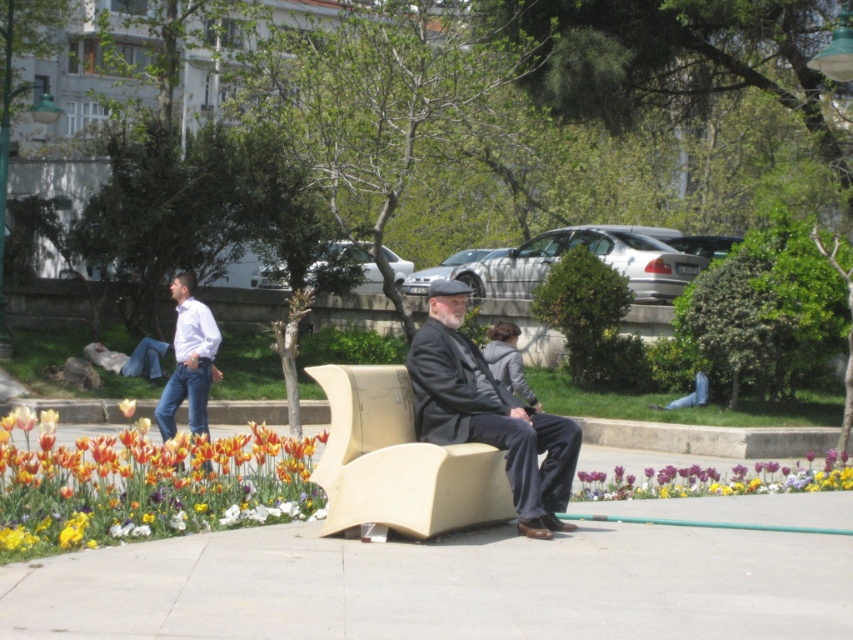
You are a gardener planning to replace the vibrant tulip bed at lower left and the orange matte tulip at center with new plants. Which area requires more new plants to fill the space?

The orange matte tulip at center requires more new plants to fill the space because the vibrant tulip bed at lower left occupies less space than the orange matte tulip at center.

You are a gardener who wants to plant a new flower between the vibrant tulip bed at lower left and the vivid purple petals at lower center. Based on their positions, where should you place the new flower?

The vibrant tulip bed at lower left is to the left of the vivid purple petals at lower center, so you should plant the new flower between them, ensuring it is positioned to the right of the vibrant tulip bed at lower left and to the left of the vivid purple petals at lower center.

You are a gardener who wants to plant a new row of flowers in the park. You have two options for flower beds to use as models. The first is the vibrant tulip bed at lower left, and the second is the orange matte tulip at center. Which flower bed has a greater width and would be better suited for creating a wider flower arrangement?

The vibrant tulip bed at lower left has a greater width than the orange matte tulip at center. Therefore, it would be better suited for creating a wider flower arrangement.